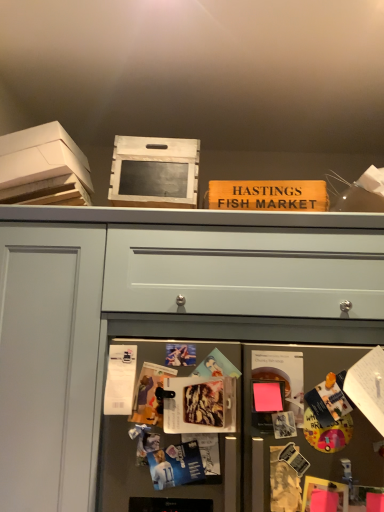
Question: In which direction should I rotate to look at wooden sign at upper center, placed as the first magazine when sorted from back to front?

Choices:
 (A) right
 (B) left

Answer: (A)

Question: Is white cardboard box at upper left next to white matte drawer at center?

Choices:
 (A) no
 (B) yes

Answer: (A)

Question: Would you consider white cardboard box at upper left to be distant from white matte drawer at center?

Choices:
 (A) yes
 (B) no

Answer: (B)

Question: Considering the relative sizes of white cardboard box at upper left and white matte drawer at center in the image provided, is white cardboard box at upper left shorter than white matte drawer at center?

Choices:
 (A) no
 (B) yes

Answer: (B)

Question: Would you say white cardboard box at upper left is outside white matte drawer at center?

Choices:
 (A) no
 (B) yes

Answer: (B)

Question: From the image's perspective, is white cardboard box at upper left beneath white matte drawer at center?

Choices:
 (A) yes
 (B) no

Answer: (B)

Question: From a real-world perspective, is white cardboard box at upper left physically below white matte drawer at center?

Choices:
 (A) yes
 (B) no

Answer: (B)

Question: From a real-world perspective, is wooden sign at upper center, which is the 3th magazine from bottom to top, located beneath wooden crate at upper center?

Choices:
 (A) yes
 (B) no

Answer: (A)

Question: Is wooden sign at upper center, placed as the third magazine when sorted from front to back, with wooden crate at upper center?

Choices:
 (A) no
 (B) yes

Answer: (A)

Question: Is wooden sign at upper center, placed as the first magazine when sorted from back to front, aimed at wooden crate at upper center?

Choices:
 (A) no
 (B) yes

Answer: (A)

Question: Is wooden sign at upper center, which is the 3th magazine from bottom to top, to the right of wooden crate at upper center from the viewer's perspective?

Choices:
 (A) no
 (B) yes

Answer: (B)

Question: Can you confirm if wooden sign at upper center, which is the 3th magazine from bottom to top, is taller than wooden crate at upper center?

Choices:
 (A) yes
 (B) no

Answer: (B)

Question: Could wooden crate at upper center be considered to be inside wooden sign at upper center, placed as the 1th magazine when sorted from top to bottom?

Choices:
 (A) no
 (B) yes

Answer: (A)

Question: Does matte plastic magazine at center, the 3th magazine when ordered from top to bottom, have a greater height compared to metallic gray fridge at lower center?

Choices:
 (A) yes
 (B) no

Answer: (B)